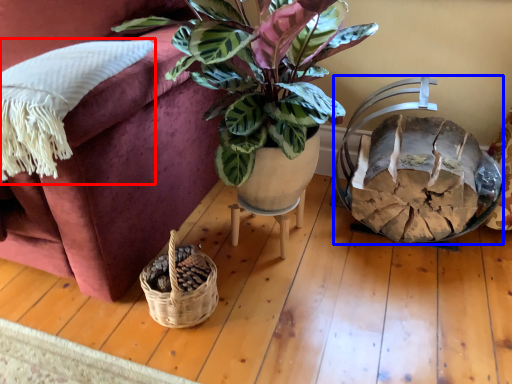
Question: Which object is further to the camera taking this photo, pillow (highlighted by a red box) or swivel chair (highlighted by a blue box)?

Choices:
 (A) pillow
 (B) swivel chair

Answer: (B)